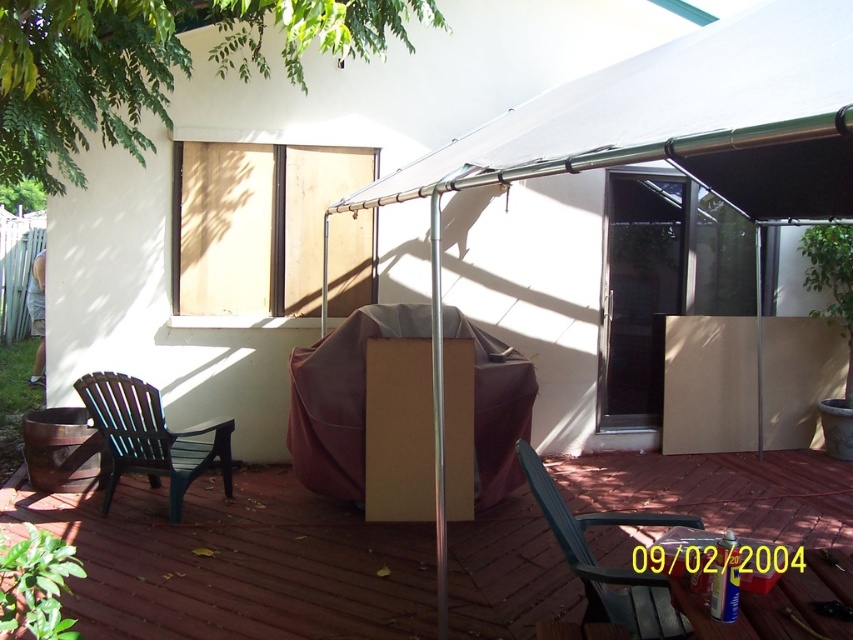
Question: Does brown cardboard box at center appear on the left side of transparent glass screen door at center?

Choices:
 (A) yes
 (B) no

Answer: (A)

Question: Which point is farther to the camera?

Choices:
 (A) black plastic armchair at left
 (B) green plastic armchair at lower left

Answer: (A)

Question: Does black plastic armchair at left have a lesser width compared to green plastic armchair at lower left?

Choices:
 (A) yes
 (B) no

Answer: (B)

Question: Where is black plastic armchair at left located in relation to green plastic armchair at lower left in the image?

Choices:
 (A) left
 (B) right

Answer: (A)

Question: Considering the real-world distances, which object is farthest from the brown cardboard box at center?

Choices:
 (A) black plastic armchair at left
 (B) transparent glass screen door at center
 (C) green plastic armchair at lower left

Answer: (B)

Question: Which object is the closest to the black plastic armchair at left?

Choices:
 (A) green plastic armchair at lower left
 (B) transparent glass screen door at center
 (C) brown cardboard box at center

Answer: (C)